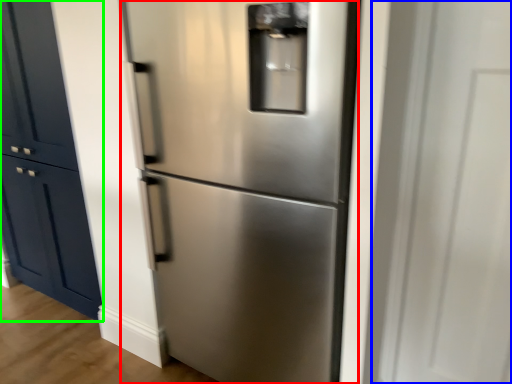
Question: Considering the real-world distances, which object is farthest from refrigerator (highlighted by a red box)? glass door (highlighted by a blue box) or door (highlighted by a green box)?

Choices:
 (A) glass door
 (B) door

Answer: (B)